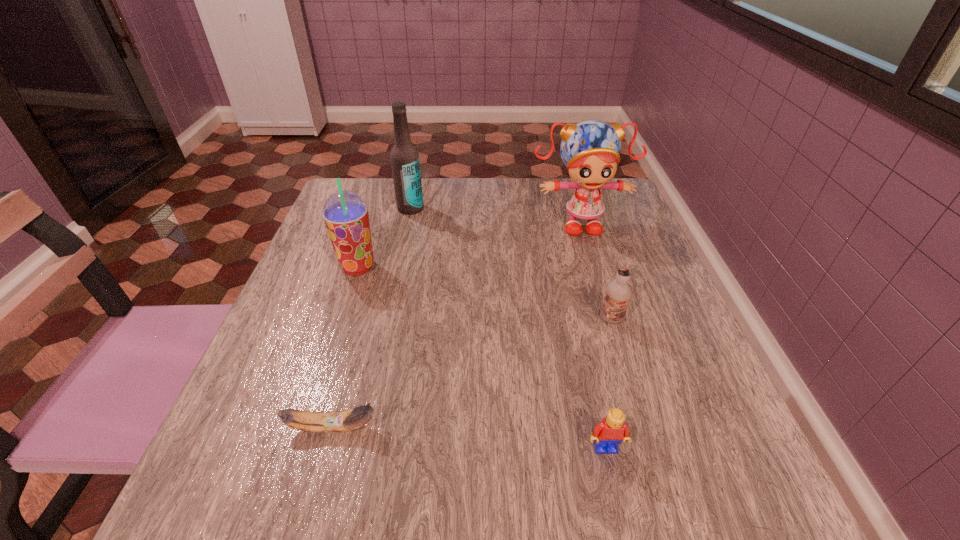
The image size is (960, 540). Identify the location of object that ranks as the second closest to the doll. pos(404,157).

Locate an element on the screen. free spot that satisfies the following two spatial constraints: 1. on the label of the beer bottle; 2. on the peel of the shortest object is located at coordinates (363, 428).

Locate an element on the screen. The image size is (960, 540). free space in the image that satisfies the following two spatial constraints: 1. on the label of the third nearest object; 2. on the left side of the beer bottle is located at coordinates (386, 319).

Identify the location of blank space that satisfies the following two spatial constraints: 1. on the face of the doll; 2. on the left side of the chocolate milk. This screenshot has width=960, height=540. (608, 319).

Identify the location of vacant region that satisfies the following two spatial constraints: 1. on the label of the fourth farthest object; 2. on the left side of the beer bottle. (386, 319).

Find the location of a particular element. The height and width of the screenshot is (540, 960). free location that satisfies the following two spatial constraints: 1. on the label of the beer bottle; 2. on the peel of the banana is located at coordinates (363, 428).